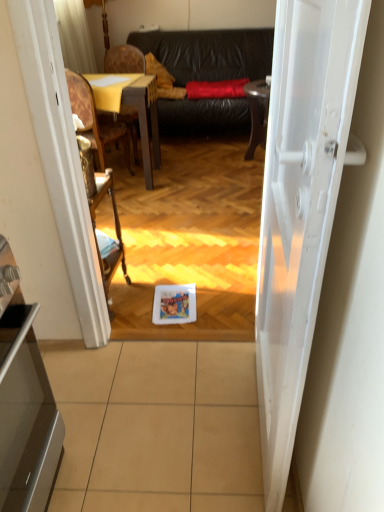
Question: Can you see wooden armchair at center touching beige tile at center?

Choices:
 (A) no
 (B) yes

Answer: (A)

Question: Could you tell me if wooden armchair at center is facing beige tile at center?

Choices:
 (A) yes
 (B) no

Answer: (B)

Question: From the image's perspective, is wooden armchair at center below beige tile at center?

Choices:
 (A) yes
 (B) no

Answer: (B)

Question: Is wooden armchair at center thinner than beige tile at center?

Choices:
 (A) no
 (B) yes

Answer: (B)

Question: From the image's perspective, would you say wooden armchair at center is positioned over beige tile at center?

Choices:
 (A) no
 (B) yes

Answer: (B)

Question: Relative to wooden textured chair at left, the 2th chair when ordered from front to back, is black leather couch at center in front or behind?

Choices:
 (A) behind
 (B) front

Answer: (A)

Question: Would you say black leather couch at center is inside or outside wooden textured chair at left, which is the first chair in back-to-front order?

Choices:
 (A) inside
 (B) outside

Answer: (B)

Question: From the image's perspective, is black leather couch at center above or below wooden textured chair at left, the 2th chair when ordered from front to back?

Choices:
 (A) above
 (B) below

Answer: (A)

Question: Would you say black leather couch at center is to the left or to the right of wooden textured chair at left, which is the first chair in back-to-front order, in the picture?

Choices:
 (A) left
 (B) right

Answer: (B)

Question: From a real-world perspective, is wooden textured chair at left, the 2th chair when ordered from front to back, physically located above or below wooden armchair at center?

Choices:
 (A) below
 (B) above

Answer: (B)

Question: Is wooden textured chair at left, which is the first chair in back-to-front order, inside the boundaries of wooden armchair at center, or outside?

Choices:
 (A) outside
 (B) inside

Answer: (A)

Question: Considering their positions, is wooden textured chair at left, the 2th chair when ordered from front to back, located in front of or behind wooden armchair at center?

Choices:
 (A) front
 (B) behind

Answer: (B)

Question: From the image's perspective, is wooden textured chair at left, the 2th chair when ordered from front to back, above or below wooden armchair at center?

Choices:
 (A) below
 (B) above

Answer: (B)

Question: Is wooden armchair at center inside the boundaries of wooden textured chair at left, the 2th chair when ordered from front to back, or outside?

Choices:
 (A) inside
 (B) outside

Answer: (B)

Question: Is point (105, 281) positioned closer to the camera than point (135, 142)?

Choices:
 (A) farther
 (B) closer

Answer: (B)